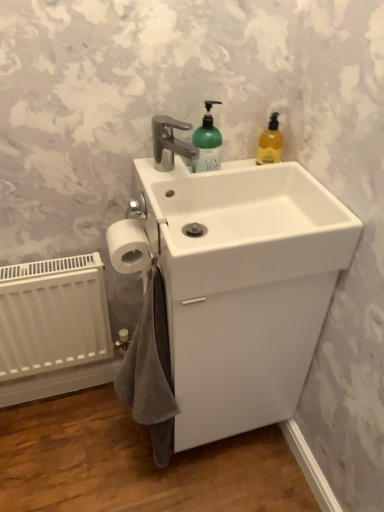
Question: Is gray cotton bath towel at lower left outside white glossy sink at center?

Choices:
 (A) yes
 (B) no

Answer: (A)

Question: From the image's perspective, is gray cotton bath towel at lower left above white glossy sink at center?

Choices:
 (A) yes
 (B) no

Answer: (B)

Question: Is gray cotton bath towel at lower left not close to white glossy sink at center?

Choices:
 (A) no
 (B) yes

Answer: (A)

Question: From a real-world perspective, does gray cotton bath towel at lower left sit lower than white glossy sink at center?

Choices:
 (A) yes
 (B) no

Answer: (A)

Question: Is gray cotton bath towel at lower left positioned with its back to white glossy sink at center?

Choices:
 (A) no
 (B) yes

Answer: (B)

Question: Is gray cotton bath towel at lower left behind white glossy sink at center?

Choices:
 (A) no
 (B) yes

Answer: (A)

Question: Does white matte radiator at lower left touch white matte toilet paper at lower left?

Choices:
 (A) yes
 (B) no

Answer: (B)

Question: Is white matte toilet paper at lower left surrounded by white matte radiator at lower left?

Choices:
 (A) no
 (B) yes

Answer: (A)

Question: Can you confirm if white matte radiator at lower left is smaller than white matte toilet paper at lower left?

Choices:
 (A) yes
 (B) no

Answer: (B)

Question: Is white matte radiator at lower left not near white matte toilet paper at lower left?

Choices:
 (A) yes
 (B) no

Answer: (B)

Question: Is white matte radiator at lower left oriented away from white matte toilet paper at lower left?

Choices:
 (A) no
 (B) yes

Answer: (A)

Question: Is white matte radiator at lower left positioned beyond the bounds of white matte toilet paper at lower left?

Choices:
 (A) no
 (B) yes

Answer: (B)

Question: Considering the relative positions of white glossy sink at center and white matte radiator at lower left in the image provided, is white glossy sink at center behind white matte radiator at lower left?

Choices:
 (A) yes
 (B) no

Answer: (B)